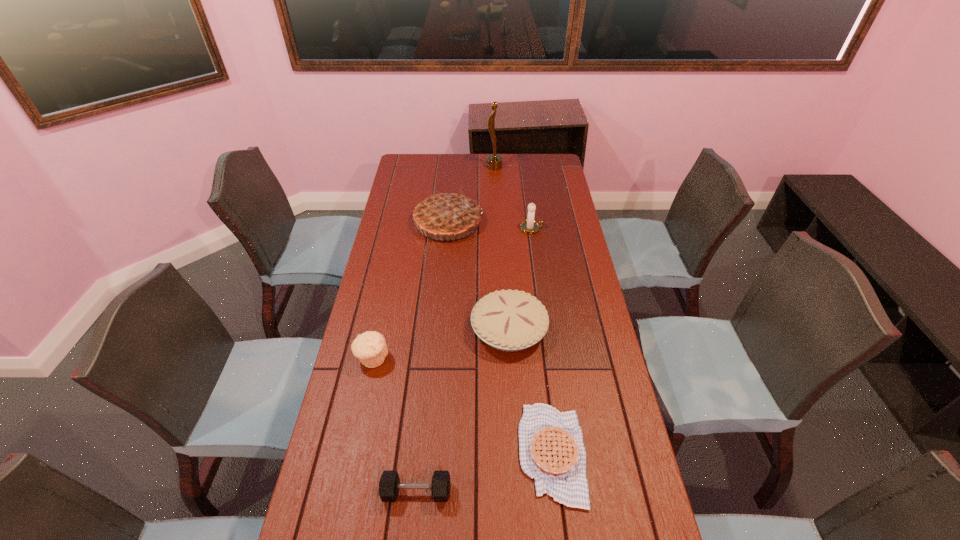
You are a GUI agent. You are given a task and a screenshot of the screen. Output one action in this format:
    pyautogui.click(x=<x>, y=<y>)
    Task: Click on the farthest object
    This screenshot has width=960, height=540.
    Given the screenshot: What is the action you would take?
    pyautogui.click(x=494, y=162)

Find the location of `award`. award is located at coordinates (494, 162).

The image size is (960, 540). In order to click on the tallest pie in this screenshot , I will do `click(445, 214)`.

Identify the location of the farthest pie. The image size is (960, 540). (445, 214).

Where is `candle holder`? The height and width of the screenshot is (540, 960). candle holder is located at coordinates (530, 226).

The height and width of the screenshot is (540, 960). I want to click on the leftmost object, so click(x=370, y=348).

The width and height of the screenshot is (960, 540). I want to click on the second tallest pie, so click(510, 320).

At what (x,y) coordinates should I click in order to perform the action: click on the second shortest object. Please return your answer as a coordinate pair (x, y). Looking at the image, I should click on (389, 485).

Where is `the nearest pie`? This screenshot has height=540, width=960. the nearest pie is located at coordinates (551, 448).

Where is `the shortest object`? The width and height of the screenshot is (960, 540). the shortest object is located at coordinates (551, 448).